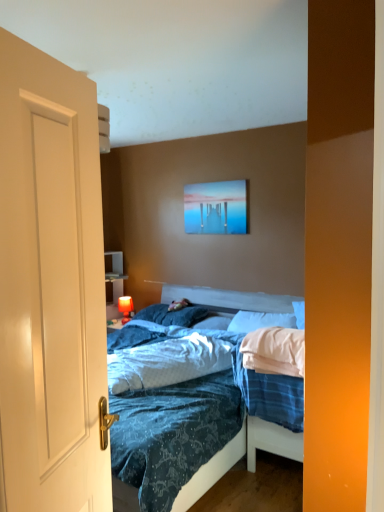
What is the approximate width of acrylic painting at upper center?

It is 1.28 inches.

Locate an element on the screen. The width and height of the screenshot is (384, 512). white matte door at left is located at coordinates (50, 287).

From the image's perspective, is matte orange lamp at left on top of blue soft pillow at center, positioned as the 1th pillow in left-to-right order?

No.

Are matte orange lamp at left and blue soft pillow at center, arranged as the 3th pillow when viewed from the right, located far from each other?

That's not correct — matte orange lamp at left is a little close to blue soft pillow at center, arranged as the 3th pillow when viewed from the right.

Based on the photo, considering the relative sizes of matte orange lamp at left and blue soft pillow at center, arranged as the 3th pillow when viewed from the right, in the image provided, is matte orange lamp at left wider than blue soft pillow at center, arranged as the 3th pillow when viewed from the right,?

No.

Can you confirm if matte orange lamp at left is shorter than blue soft pillow at center, positioned as the 1th pillow in left-to-right order?

Incorrect, the height of matte orange lamp at left does not fall short of that of blue soft pillow at center, positioned as the 1th pillow in left-to-right order.

From a real-world perspective, is matte orange lamp at left positioned above or below pillow at center, marked as the third pillow in a left-to-right arrangement?

In terms of real-world spatial position, matte orange lamp at left is below pillow at center, marked as the third pillow in a left-to-right arrangement.

Considering the points (132, 302) and (250, 317), which point is behind, point (132, 302) or point (250, 317)?

The point (132, 302) is more distant.

Is matte orange lamp at left positioned with its back to pillow at center, marked as the third pillow in a left-to-right arrangement?

That's not correct — matte orange lamp at left is not looking away from pillow at center, marked as the third pillow in a left-to-right arrangement.

Which of these two, acrylic painting at upper center or blue textured fabric at center, is smaller?

With smaller size is acrylic painting at upper center.

Which object is further away from the camera taking this photo, acrylic painting at upper center or blue textured fabric at center?

acrylic painting at upper center is more distant.

Which is more distant, [237,226] or [178,347]?

The point [237,226] is farther from the camera.

Is acrylic painting at upper center spatially inside blue textured fabric at center, or outside of it?

acrylic painting at upper center is spatially situated outside blue textured fabric at center.

Is blue textured fabric at center completely or partially outside of pillow at center, marked as the third pillow in a left-to-right arrangement?

That's correct, blue textured fabric at center is outside of pillow at center, marked as the third pillow in a left-to-right arrangement.

Looking at this image, is blue textured fabric at center facing towards pillow at center, marked as the third pillow in a left-to-right arrangement?

No, blue textured fabric at center does not turn towards pillow at center, marked as the third pillow in a left-to-right arrangement.

Does blue textured fabric at center touch pillow at center, marked as the third pillow in a left-to-right arrangement?

No, blue textured fabric at center is not next to pillow at center, marked as the third pillow in a left-to-right arrangement.

From the picture: From a real-world perspective, which object rests below the other?

blue textured fabric at center is physically lower.

How much distance is there between pillow at center, arranged as the first pillow when viewed from the right, and white matte door at left?

A distance of 8.06 feet exists between pillow at center, arranged as the first pillow when viewed from the right, and white matte door at left.

Can you tell me how much pillow at center, arranged as the first pillow when viewed from the right, and white matte door at left differ in facing direction?

They differ by 105 degrees in their facing directions.

Is pillow at center, marked as the third pillow in a left-to-right arrangement, in front of white matte door at left?

No, the depth of pillow at center, marked as the third pillow in a left-to-right arrangement, is greater than that of white matte door at left.

Based on their sizes in the image, would you say pillow at center, arranged as the first pillow when viewed from the right, is bigger or smaller than white matte door at left?

pillow at center, arranged as the first pillow when viewed from the right, is bigger than white matte door at left.

Who is bigger, blue textured fabric at center or blue soft pillow at center, arranged as the 3th pillow when viewed from the right?

blue textured fabric at center is bigger.

Looking at their sizes, would you say blue textured fabric at center is wider or thinner than blue soft pillow at center, positioned as the 1th pillow in left-to-right order?

Considering their sizes, blue textured fabric at center looks broader than blue soft pillow at center, positioned as the 1th pillow in left-to-right order.

Is blue textured fabric at center not within blue soft pillow at center, arranged as the 3th pillow when viewed from the right?

Yes.

Does blue textured fabric at center appear on the left side of matte orange lamp at left?

In fact, blue textured fabric at center is to the right of matte orange lamp at left.

Is blue textured fabric at center next to matte orange lamp at left and touching it?

No, blue textured fabric at center is not in contact with matte orange lamp at left.

From the image's perspective, which object appears higher, blue textured fabric at center or matte orange lamp at left?

From the image's view, matte orange lamp at left is above.

Is blue textured fabric at center facing away from matte orange lamp at left?

No, blue textured fabric at center's orientation is not away from matte orange lamp at left.

Where is `lamp located on the left of blue soft pillow at center, arranged as the 3th pillow when viewed from the right`? Image resolution: width=384 pixels, height=512 pixels. lamp located on the left of blue soft pillow at center, arranged as the 3th pillow when viewed from the right is located at coordinates (125, 308).

This screenshot has height=512, width=384. In order to click on lamp below the pillow at center, arranged as the first pillow when viewed from the right (from a real-world perspective) in this screenshot , I will do `click(125, 308)`.

When comparing their distances from blue textured fabric at center, does pillow at center, arranged as the first pillow when viewed from the right, or white soft pillow at center, the second pillow positioned from the left, seem closer?

pillow at center, arranged as the first pillow when viewed from the right.

Estimate the real-world distances between objects in this image. Which object is further from blue textured fabric at center, blue soft pillow at center, arranged as the 3th pillow when viewed from the right, or matte orange lamp at left?

Among the two, matte orange lamp at left is located further to blue textured fabric at center.

When comparing their distances from blue soft pillow at center, positioned as the 1th pillow in left-to-right order, does acrylic painting at upper center or matte orange lamp at left seem further?

acrylic painting at upper center is positioned further to the anchor blue soft pillow at center, positioned as the 1th pillow in left-to-right order.

Looking at the image, which one is located further to matte orange lamp at left, blue soft pillow at center, positioned as the 1th pillow in left-to-right order, or pillow at center, marked as the third pillow in a left-to-right arrangement?

pillow at center, marked as the third pillow in a left-to-right arrangement, is further to matte orange lamp at left.

Considering their positions, is blue soft pillow at center, arranged as the 3th pillow when viewed from the right, positioned further to white soft pillow at center, the second pillow positioned from the left, than acrylic painting at upper center?

acrylic painting at upper center is further to white soft pillow at center, the second pillow positioned from the left.

From the image, which object appears to be nearer to pillow at center, marked as the third pillow in a left-to-right arrangement, blue textured fabric at center or white matte door at left?

blue textured fabric at center is closer to pillow at center, marked as the third pillow in a left-to-right arrangement.

Based on their spatial positions, is blue textured fabric at center or matte orange lamp at left further from white soft pillow at center, the second pillow positioned from the left?

Among the two, matte orange lamp at left is located further to white soft pillow at center, the second pillow positioned from the left.

In the scene shown: Which object lies further to the anchor point blue textured fabric at center, white matte door at left or blue soft pillow at center, positioned as the 1th pillow in left-to-right order?

A: white matte door at left lies further to blue textured fabric at center than the other object.

What are the coordinates of `lamp that lies between acrylic painting at upper center and white soft pillow at center, the second pillow positioned from the left, from top to bottom` in the screenshot? It's located at (125, 308).

The width and height of the screenshot is (384, 512). I want to click on pillow between acrylic painting at upper center and pillow at center, marked as the third pillow in a left-to-right arrangement, vertically, so point(173,315).

Locate an element on the screen. The image size is (384, 512). picture frame between matte orange lamp at left and pillow at center, marked as the third pillow in a left-to-right arrangement, from left to right is located at coordinates (216, 207).

Locate an element on the screen. This screenshot has width=384, height=512. picture frame between blue textured fabric at center and matte orange lamp at left from front to back is located at coordinates (216, 207).